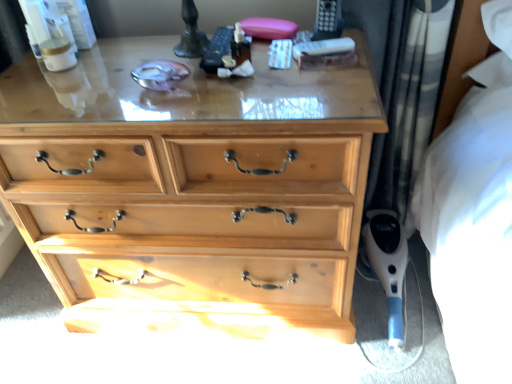
Question: Is blue plastic vacuum cleaner at lower right taller than plaid fabric curtain at right?

Choices:
 (A) no
 (B) yes

Answer: (A)

Question: Considering the relative sizes of blue plastic vacuum cleaner at lower right and plaid fabric curtain at right in the image provided, is blue plastic vacuum cleaner at lower right smaller than plaid fabric curtain at right?

Choices:
 (A) yes
 (B) no

Answer: (A)

Question: Is blue plastic vacuum cleaner at lower right at the right side of plaid fabric curtain at right?

Choices:
 (A) yes
 (B) no

Answer: (A)

Question: Does blue plastic vacuum cleaner at lower right have a larger size compared to plaid fabric curtain at right?

Choices:
 (A) yes
 (B) no

Answer: (B)

Question: From a real-world perspective, is blue plastic vacuum cleaner at lower right physically above plaid fabric curtain at right?

Choices:
 (A) no
 (B) yes

Answer: (A)

Question: Is blue plastic vacuum cleaner at lower right oriented towards plaid fabric curtain at right?

Choices:
 (A) yes
 (B) no

Answer: (B)

Question: Considering the relative sizes of plaid fabric curtain at right and blue plastic vacuum cleaner at lower right in the image provided, is plaid fabric curtain at right bigger than blue plastic vacuum cleaner at lower right?

Choices:
 (A) no
 (B) yes

Answer: (B)

Question: Is plaid fabric curtain at right next to blue plastic vacuum cleaner at lower right and touching it?

Choices:
 (A) no
 (B) yes

Answer: (A)

Question: From the image's perspective, is plaid fabric curtain at right over blue plastic vacuum cleaner at lower right?

Choices:
 (A) yes
 (B) no

Answer: (A)

Question: Could blue plastic vacuum cleaner at lower right be considered to be inside plaid fabric curtain at right?

Choices:
 (A) no
 (B) yes

Answer: (A)

Question: Does plaid fabric curtain at right have a lesser height compared to blue plastic vacuum cleaner at lower right?

Choices:
 (A) yes
 (B) no

Answer: (B)

Question: Considering the relative positions of plaid fabric curtain at right and blue plastic vacuum cleaner at lower right in the image provided, is plaid fabric curtain at right to the right of blue plastic vacuum cleaner at lower right from the viewer's perspective?

Choices:
 (A) yes
 (B) no

Answer: (B)

Question: Does blue plastic vacuum cleaner at lower right have a lesser height compared to natural wood chest of drawers at center?

Choices:
 (A) yes
 (B) no

Answer: (A)